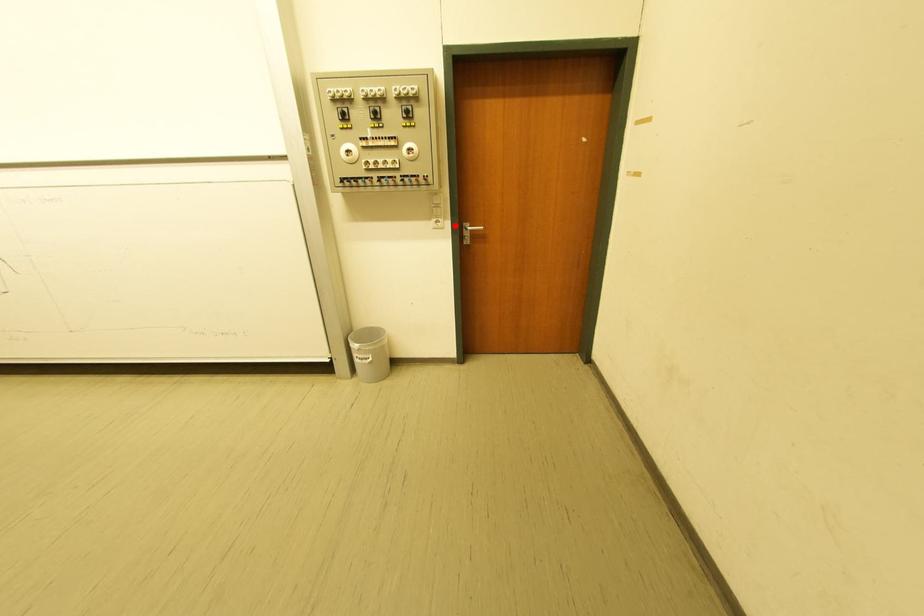
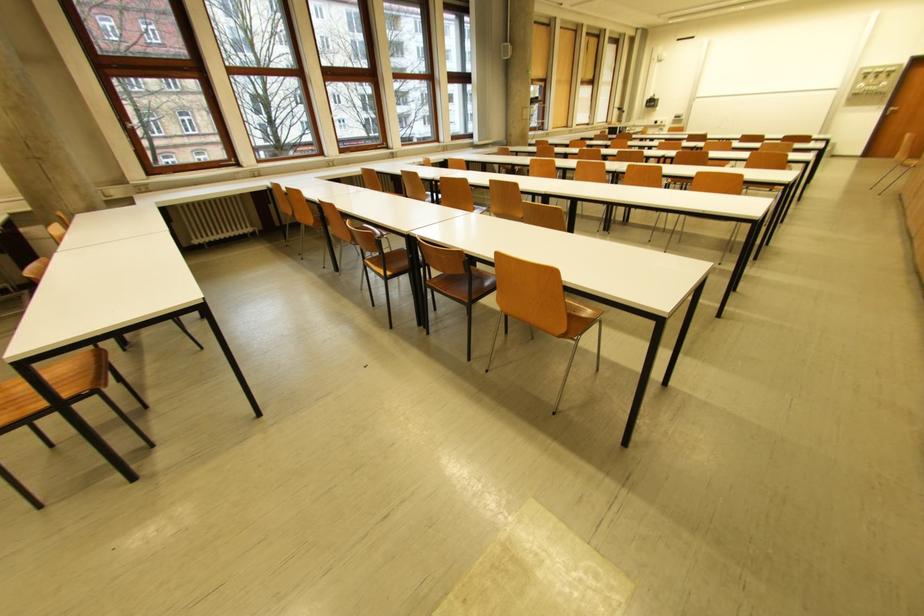
Locate, in the second image, the point that corresponds to the highlighted location in the first image.

(891, 108)